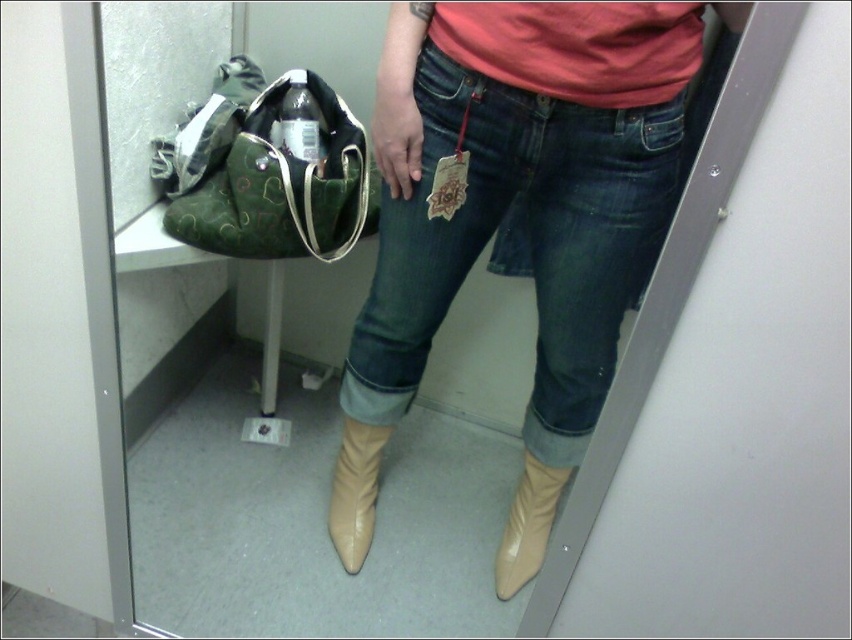
Question: Which point appears farthest from the camera in this image?

Choices:
 (A) (263, 205)
 (B) (398, 294)
 (C) (542, 541)

Answer: (C)

Question: Can you confirm if denim at center is bigger than beige leather boot at lower center?

Choices:
 (A) no
 (B) yes

Answer: (B)

Question: Which object is closer to the camera taking this photo?

Choices:
 (A) tan leather boot at center
 (B) beige leather boot at lower center

Answer: (B)

Question: Is denim at center bigger than tan leather boot at center?

Choices:
 (A) yes
 (B) no

Answer: (A)

Question: Which object is the farthest from the green canvas handbag at left?

Choices:
 (A) tan leather boot at center
 (B) denim at center

Answer: (A)

Question: Observing the image, what is the correct spatial positioning of green canvas handbag at left in reference to tan leather boot at center?

Choices:
 (A) right
 (B) left

Answer: (B)